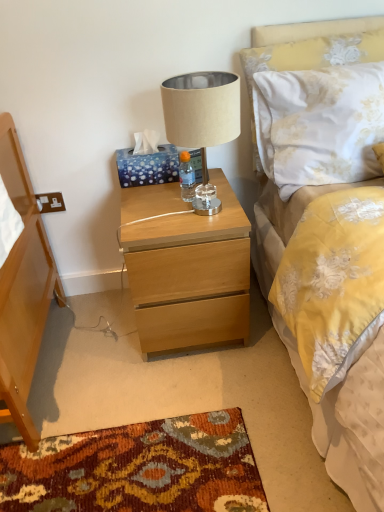
Question: Is beige fabric lampshade at center surrounded by light wood nightstand at center?

Choices:
 (A) yes
 (B) no

Answer: (B)

Question: Does light wood nightstand at center have a greater height compared to beige fabric lampshade at center?

Choices:
 (A) no
 (B) yes

Answer: (B)

Question: Can you confirm if light wood nightstand at center is shorter than beige fabric lampshade at center?

Choices:
 (A) no
 (B) yes

Answer: (A)

Question: Considering the relative sizes of light wood nightstand at center and beige fabric lampshade at center in the image provided, is light wood nightstand at center thinner than beige fabric lampshade at center?

Choices:
 (A) yes
 (B) no

Answer: (B)

Question: Is light wood nightstand at center at the right side of beige fabric lampshade at center?

Choices:
 (A) no
 (B) yes

Answer: (A)

Question: Is light wood nightstand at center in front of beige fabric lampshade at center?

Choices:
 (A) yes
 (B) no

Answer: (B)

Question: From the image's perspective, would you say beige fabric lampshade at center is shown under clear plastic bottle at center?

Choices:
 (A) yes
 (B) no

Answer: (B)

Question: Does beige fabric lampshade at center appear on the right side of clear plastic bottle at center?

Choices:
 (A) yes
 (B) no

Answer: (A)

Question: Considering the relative sizes of beige fabric lampshade at center and clear plastic bottle at center in the image provided, is beige fabric lampshade at center shorter than clear plastic bottle at center?

Choices:
 (A) yes
 (B) no

Answer: (B)

Question: Is the position of beige fabric lampshade at center more distant than that of clear plastic bottle at center?

Choices:
 (A) no
 (B) yes

Answer: (A)

Question: Is beige fabric lampshade at center smaller than clear plastic bottle at center?

Choices:
 (A) no
 (B) yes

Answer: (A)

Question: Is beige fabric lampshade at center thinner than clear plastic bottle at center?

Choices:
 (A) no
 (B) yes

Answer: (A)

Question: Can you confirm if clear plastic bottle at center is smaller than beige fabric lampshade at center?

Choices:
 (A) yes
 (B) no

Answer: (A)